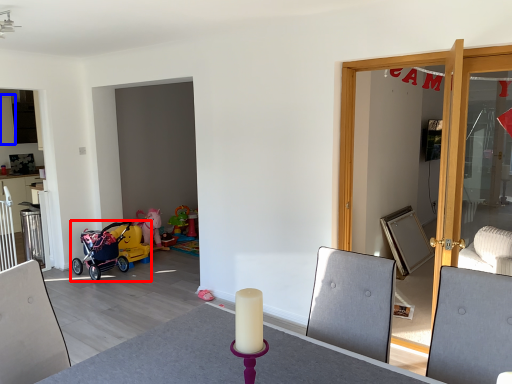
Question: Which point is further to the camera, stroller (highlighted by a red box) or cabinetry (highlighted by a blue box)?

Choices:
 (A) stroller
 (B) cabinetry

Answer: (B)